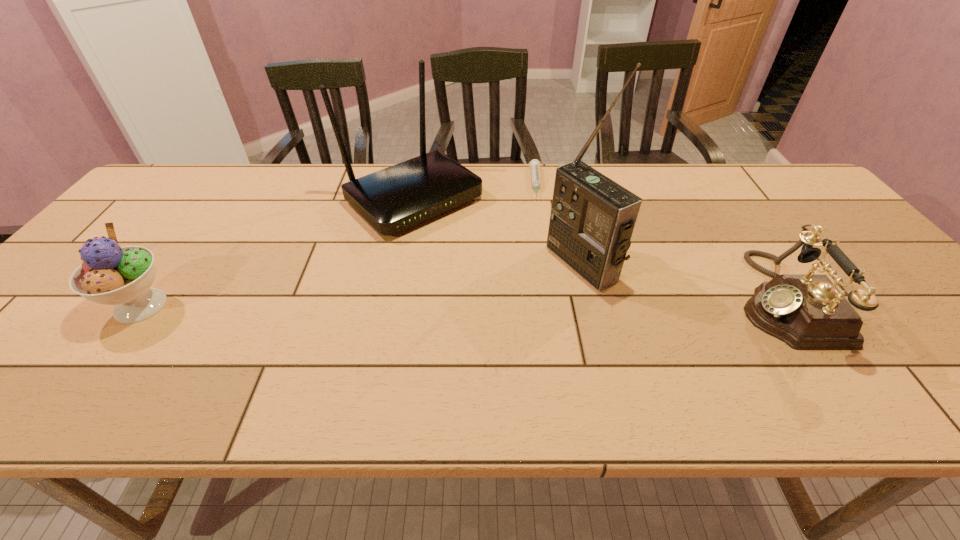
You are a GUI agent. You are given a task and a screenshot of the screen. Output one action in this format:
    pyautogui.click(x=<x>, y=<y>)
    Task: Click on the leftmost object
    Image resolution: width=960 pixels, height=540 pixels.
    Given the screenshot: What is the action you would take?
    pyautogui.click(x=110, y=275)

Where is `the rightmost object`? The height and width of the screenshot is (540, 960). the rightmost object is located at coordinates click(807, 312).

Where is `radio receiver`? The width and height of the screenshot is (960, 540). radio receiver is located at coordinates (x=592, y=219).

At what (x,y) coordinates should I click in order to perform the action: click on the second tallest object. Please return your answer as a coordinate pair (x, y). The height and width of the screenshot is (540, 960). Looking at the image, I should click on (393, 199).

The width and height of the screenshot is (960, 540). Identify the location of router. (393, 199).

Where is `the shortest object`? the shortest object is located at coordinates (534, 164).

At what (x,y) coordinates should I click in order to perform the action: click on free spot located 0.320m on the right of the leftmost object. Please return your answer as a coordinate pair (x, y). This screenshot has height=540, width=960. Looking at the image, I should click on (314, 306).

Image resolution: width=960 pixels, height=540 pixels. What are the coordinates of `vacant space located on the dial of the rightmost object` in the screenshot? It's located at (564, 299).

The width and height of the screenshot is (960, 540). Identify the location of vacant space located on the dial of the rightmost object. (698, 299).

The height and width of the screenshot is (540, 960). Find the location of `vacant area situated 0.270m on the dial of the rightmost object`. vacant area situated 0.270m on the dial of the rightmost object is located at coordinates (620, 299).